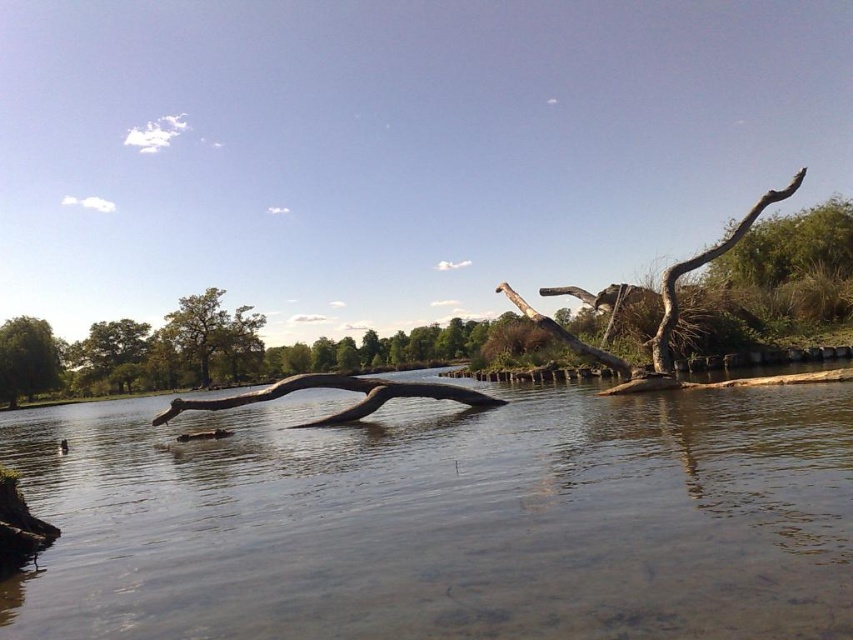
Based on the coordinates provided, which object is located at point (27,358)?

The point (27,358) indicates the green leafy tree at left.

You are standing at the camera position and want to take a photo of the green matte tree at upper left. Do you think you can capture the entire tree in your photo without moving your camera? Explain your reasoning based on the distance provided.

The green matte tree at upper left and the camera are 88.15 meters apart. Whether the entire tree can be captured depends on the camera lens used. A wide angle lens might capture the whole tree from this distance, while a standard or telephoto lens might not. However, since the question doesn answer the distance alone, it is possible to capture the tree but the field of view of the camera is needed to determine certainty.

You are an artist planning to paint the scene. You want to ensure the brown wood river at center and the green leafy tree at left are proportionally accurate. Which object should you make larger in your painting?

The brown wood river at center should be made larger in the painting since it has a larger size compared to the green leafy tree at left according to the description.